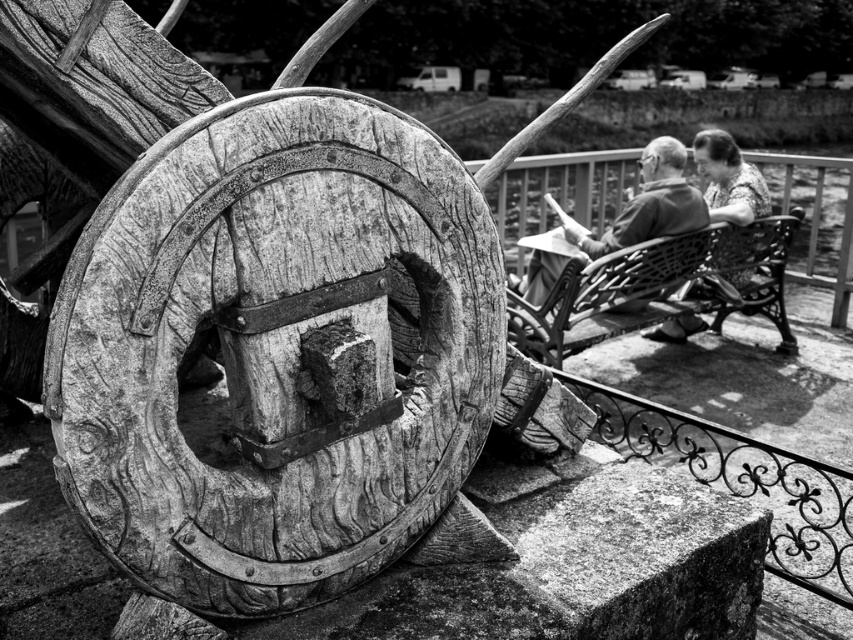
Which is behind, point (724, 230) or point (676, 339)?

Point (676, 339)

Does woven wicker bench at right have a larger size compared to smooth fabric blouse at upper right?

Correct, woven wicker bench at right is larger in size than smooth fabric blouse at upper right.

Is point (670, 301) positioned before point (709, 204)?

Yes, it is.

The height and width of the screenshot is (640, 853). Find the location of `woven wicker bench at right`. woven wicker bench at right is located at coordinates (660, 288).

Which is in front, point (698, 195) or point (738, 205)?

Point (698, 195) is in front.

Find the location of a particular element. This screenshot has width=853, height=640. smooth wood chair at upper right is located at coordinates (x=648, y=204).

Who is positioned more to the left, woven wicker bench at right or smooth wood chair at upper right?

Positioned to the left is smooth wood chair at upper right.

Can you confirm if woven wicker bench at right is bigger than smooth wood chair at upper right?

Correct, woven wicker bench at right is larger in size than smooth wood chair at upper right.

Find the location of a particular element. The width and height of the screenshot is (853, 640). woven wicker bench at right is located at coordinates (660, 288).

The image size is (853, 640). I want to click on woven wicker bench at right, so click(660, 288).